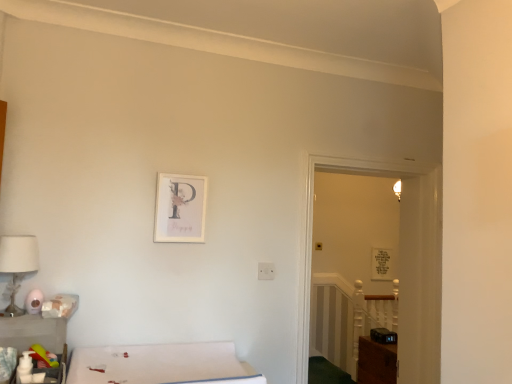
Question: Is white fabric lampshade at left spatially inside matte plastic toiletries at lower left, marked as the 1th table in a back-to-front arrangement, or outside of it?

Choices:
 (A) outside
 (B) inside

Answer: (A)

Question: From the image's perspective, is white fabric lampshade at left positioned above or below matte plastic toiletries at lower left, arranged as the 2th table when viewed from the front?

Choices:
 (A) above
 (B) below

Answer: (A)

Question: Estimate the real-world distances between objects in this image. Which object is closer to the white fabric bed at lower left?

Choices:
 (A) clear glass door at center
 (B) white matte picture frame at upper center, which appears as the first picture frame when viewed from the left
 (C) white fabric lampshade at left
 (D) matte plastic toiletries at lower left, arranged as the second table when viewed from the back
 (E) rubber yellow toy at lower left

Answer: (D)

Question: Estimate the real-world distances between objects in this image. Which object is farther from the white fabric bed at lower left?

Choices:
 (A) matte white picture frame at upper center, the first picture frame positioned from the bottom
 (B) matte plastic toiletries at lower left, arranged as the 2th table when viewed from the front
 (C) rubber yellow toy at lower left
 (D) matte plastic toiletries at lower left, the first table from the front
 (E) white matte picture frame at upper center, which appears as the first picture frame when viewed from the front

Answer: (A)